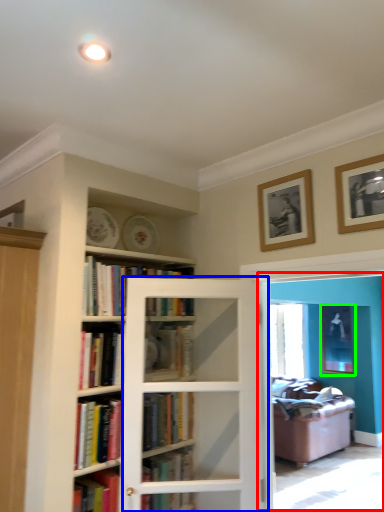
Question: Based on their relative distances, which object is farther from screen door (highlighted by a red box)? Choose from screen door (highlighted by a blue box) and picture frame (highlighted by a green box).

Choices:
 (A) screen door
 (B) picture frame

Answer: (A)